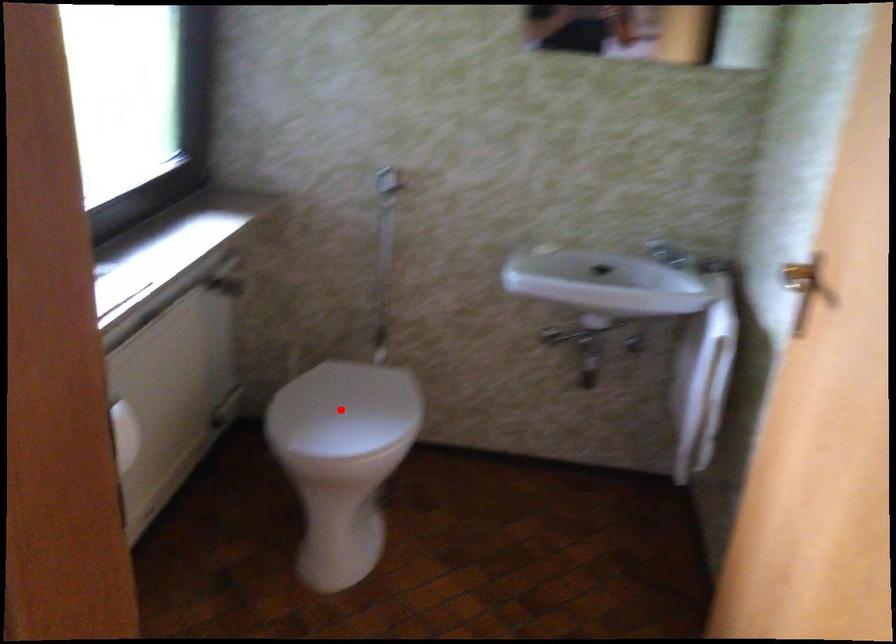
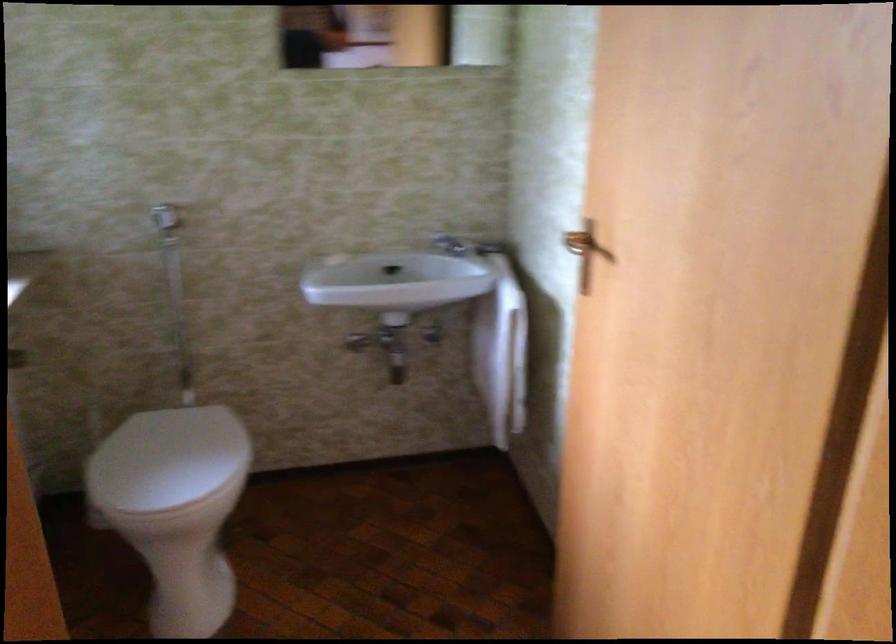
In the second image, find the point that corresponds to the highlighted location in the first image.

(167, 460)